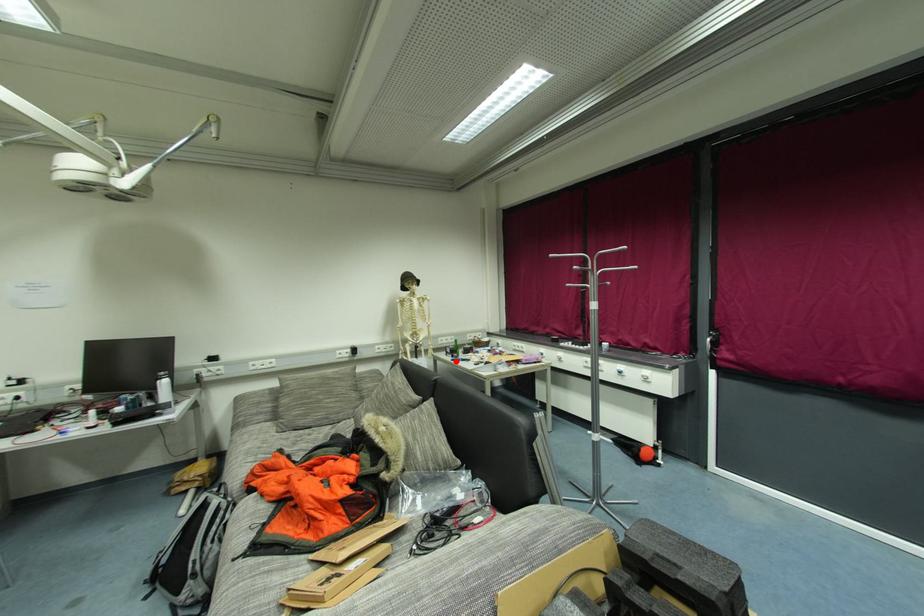
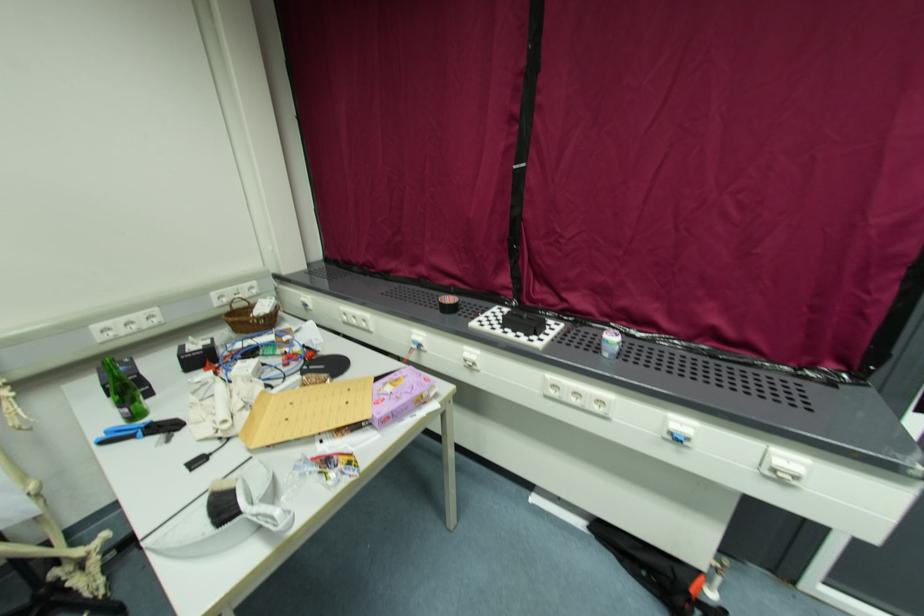
Question: I am providing you with two images of the same scene from different viewpoints. A red point is shown in image1. For the corresponding object point in image2, is it positioned nearer or farther from the camera?

Choices:
 (A) Nearer
 (B) Farther

Answer: (A)